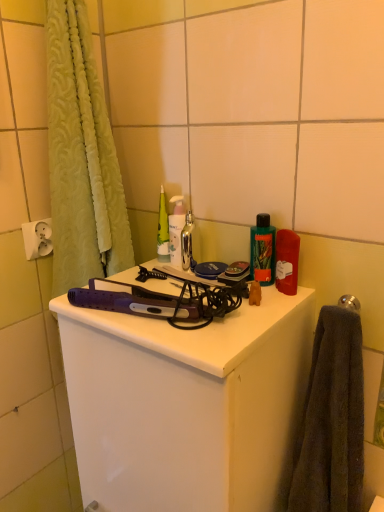
Question: From a real-world perspective, is green plastic bottle at upper right, the 1th toiletry in the front-to-back sequence, located higher than shiny metallic faucet at center?

Choices:
 (A) no
 (B) yes

Answer: (B)

Question: Are green plastic bottle at upper right, placed as the second toiletry when sorted from left to right, and shiny metallic faucet at center far apart?

Choices:
 (A) no
 (B) yes

Answer: (A)

Question: Does green plastic bottle at upper right, acting as the second toiletry starting from the back, lie behind shiny metallic faucet at center?

Choices:
 (A) yes
 (B) no

Answer: (B)

Question: Does green plastic bottle at upper right, which appears as the first toiletry when viewed from the right, touch shiny metallic faucet at center?

Choices:
 (A) yes
 (B) no

Answer: (B)

Question: Is green plastic bottle at upper right, which appears as the first toiletry when viewed from the right, shorter than shiny metallic faucet at center?

Choices:
 (A) no
 (B) yes

Answer: (A)

Question: Can you confirm if green plastic bottle at upper right, the 1th toiletry in the front-to-back sequence, is wider than shiny metallic faucet at center?

Choices:
 (A) no
 (B) yes

Answer: (A)

Question: Can you confirm if shiny metallic faucet at center is positioned to the right of green plastic bottle at upper right, acting as the second toiletry starting from the back?

Choices:
 (A) no
 (B) yes

Answer: (A)

Question: Considering the relative positions of shiny metallic faucet at center and green plastic bottle at upper right, placed as the second toiletry when sorted from left to right, in the image provided, is shiny metallic faucet at center to the left of green plastic bottle at upper right, placed as the second toiletry when sorted from left to right, from the viewer's perspective?

Choices:
 (A) no
 (B) yes

Answer: (B)

Question: Does shiny metallic faucet at center have a greater width compared to green plastic bottle at upper right, acting as the second toiletry starting from the back?

Choices:
 (A) no
 (B) yes

Answer: (B)

Question: Does shiny metallic faucet at center have a greater height compared to green plastic bottle at upper right, placed as the second toiletry when sorted from left to right?

Choices:
 (A) no
 (B) yes

Answer: (A)

Question: From the image's perspective, is shiny metallic faucet at center beneath green plastic bottle at upper right, the 1th toiletry in the front-to-back sequence?

Choices:
 (A) no
 (B) yes

Answer: (A)

Question: Can green plastic bottle at upper right, the 1th toiletry in the front-to-back sequence, be found inside shiny metallic faucet at center?

Choices:
 (A) no
 (B) yes

Answer: (A)

Question: Is polished silver towel bar at upper right with dark gray towel at right?

Choices:
 (A) no
 (B) yes

Answer: (A)